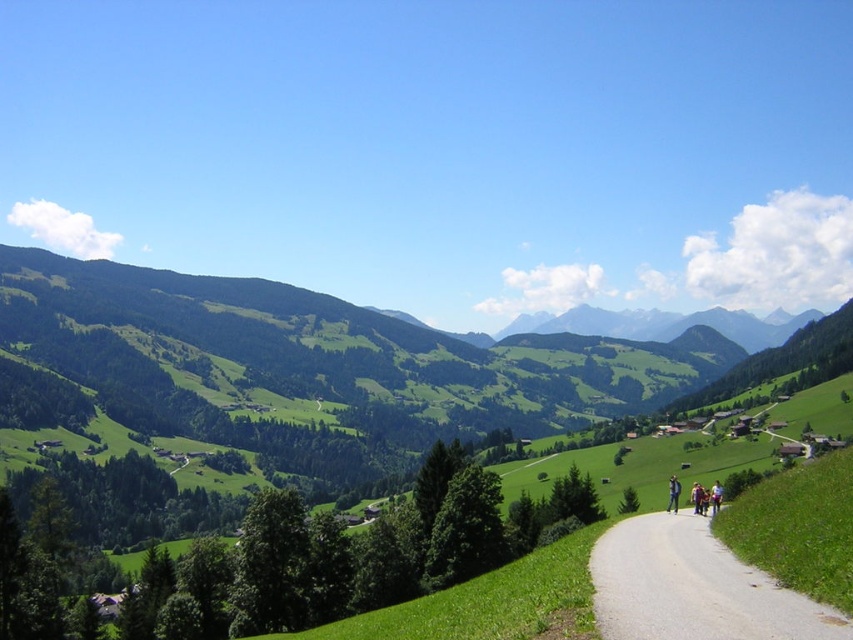
Can you confirm if gray gravel road at center is shorter than blue fabric jacket at center-right?

Correct, gray gravel road at center is not as tall as blue fabric jacket at center-right.

Which is in front, point (688, 577) or point (672, 508)?

Positioned in front is point (688, 577).

Who is more forward, (596, 540) or (671, 476)?

Positioned in front is point (596, 540).

At what (x,y) coordinates should I click in order to perform the action: click on gray gravel road at center. Please return your answer as a coordinate pair (x, y). This screenshot has height=640, width=853. Looking at the image, I should click on (694, 588).